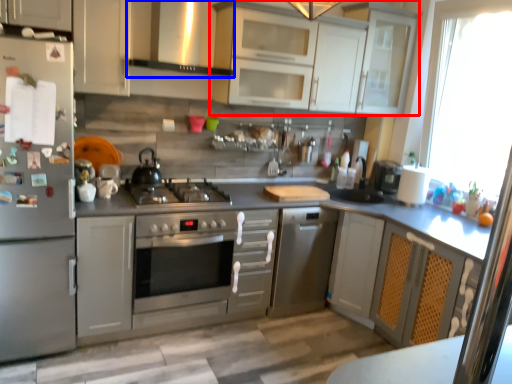
Question: Which point is further to the camera, cabinetry (highlighted by a red box) or exhaust hood (highlighted by a blue box)?

Choices:
 (A) cabinetry
 (B) exhaust hood

Answer: (A)